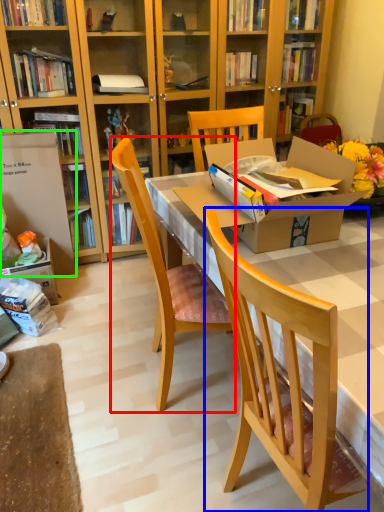
Question: Estimate the real-world distances between objects in this image. Which object is closer to chair (highlighted by a red box), chair (highlighted by a blue box) or box (highlighted by a green box)?

Choices:
 (A) chair
 (B) box

Answer: (A)